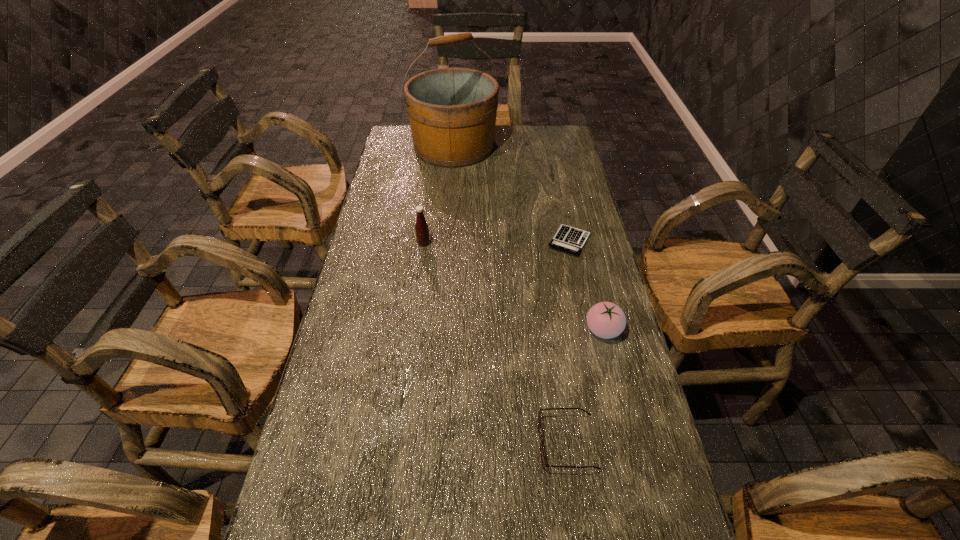
This screenshot has height=540, width=960. In order to click on vacant area situated 0.290m on the front of the tomato in this screenshot , I will do tap(634, 457).

This screenshot has width=960, height=540. Find the location of `vacant area situated on the lenses of the spectacles`. vacant area situated on the lenses of the spectacles is located at coordinates (457, 443).

At what (x,y) coordinates should I click in order to perform the action: click on free space located on the lenses of the spectacles. Please return your answer as a coordinate pair (x, y). The width and height of the screenshot is (960, 540). Looking at the image, I should click on (361, 443).

I want to click on free space located on the lenses of the spectacles, so click(x=361, y=443).

Where is `free spot located 0.220m on the left of the calculator`? Image resolution: width=960 pixels, height=540 pixels. free spot located 0.220m on the left of the calculator is located at coordinates point(479,241).

Where is `object positioned at the far edge`? The width and height of the screenshot is (960, 540). object positioned at the far edge is located at coordinates (452, 112).

I want to click on object at the left edge, so click(452, 112).

At what (x,y) coordinates should I click in order to perform the action: click on tomato that is at the right edge. Please return your answer as a coordinate pair (x, y). This screenshot has width=960, height=540. Looking at the image, I should click on (606, 320).

Image resolution: width=960 pixels, height=540 pixels. I want to click on spectacles situated at the right edge, so click(542, 455).

I want to click on calculator that is at the right edge, so click(x=569, y=239).